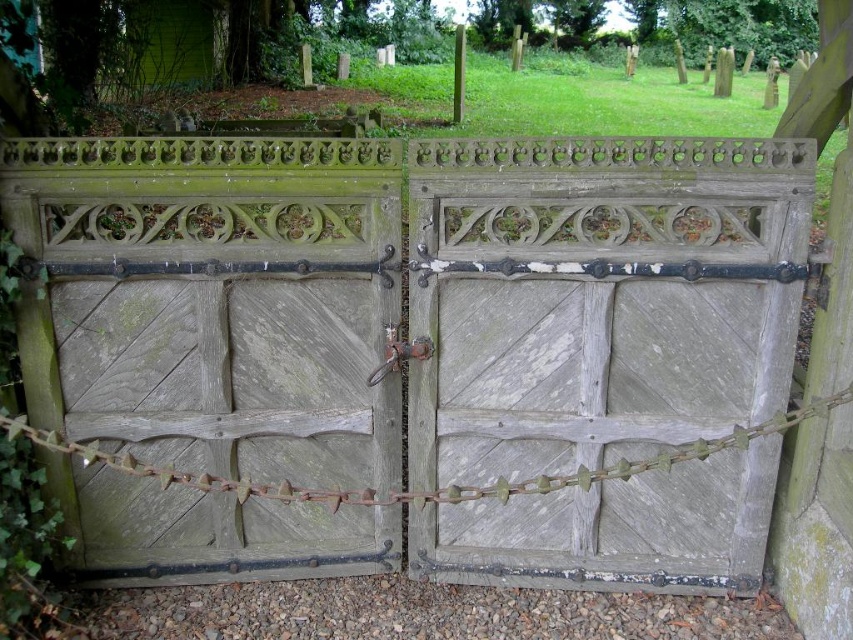
You are a painter who needs to move a ladder through the gates. The ladder is 1.5 meters wide. You see the green wood gate at center and the weathered wood gate at center. Which gate do you think the ladder can fit through?

The green wood gate at center might be wider than weathered wood gate at center, so the ladder can fit through the green wood gate at center if it is indeed wider, but cannot fit through the weathered wood gate at center which is narrower. However, since the exact width difference isn not specified, the safest choice would be to try the green wood gate at center first.

You are standing in front of the cemetery gates and need to pass through. There are two gates here labeled as green wood gate at center and weathered wood gate at center. Which gate should you open first to enter?

You should open the green wood gate at center first since it is positioned to the left of the weathered wood gate at center, making it the appropriate gate to open first for entry.

You are standing at the entrance of the cemetery and see two points marked on the gates. The first point is at coordinates point [39,145] and the second is at point [599,438]. Which point is closer to you as you face the gates?

Point [39,145] is in front of point [599,438], so the first point is closer to you when facing the gates.